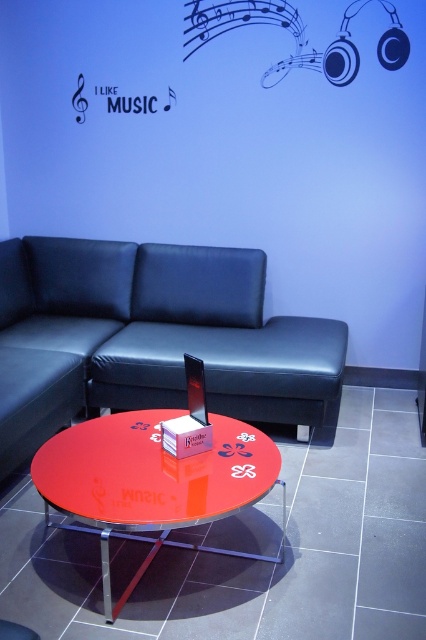
You are planning to place a large potted plant between the black leather couch at center and the glossy red table at center. Considering their sizes, which object should the plant be placed closer to and why?

The plant should be placed closer to the glossy red table at center because the black leather couch at center is larger in size, so the table is smaller and the space between them may be more suitable near the smaller object.

In the scene shown: You are planning to place a new rectangular side table next to the black leather couch at center. The side table is 1.2 meters wide. Given the space between the couch and the glossy red table at center, can the side table fit there without touching either object?

The black leather couch at center is wider than the glossy red table at center. However, the exact distance between them isn

You are standing at the entrance of the room and want to move towards the point at coordinates point (57,276). However, there is an obstacle at point (242,454). Based on the spatial relationship between these two points, will you encounter the obstacle before reaching your destination?

Since point (57,276) is behind point (242,454), you will encounter the obstacle at point (242,454) before reaching your destination at point (57,276).